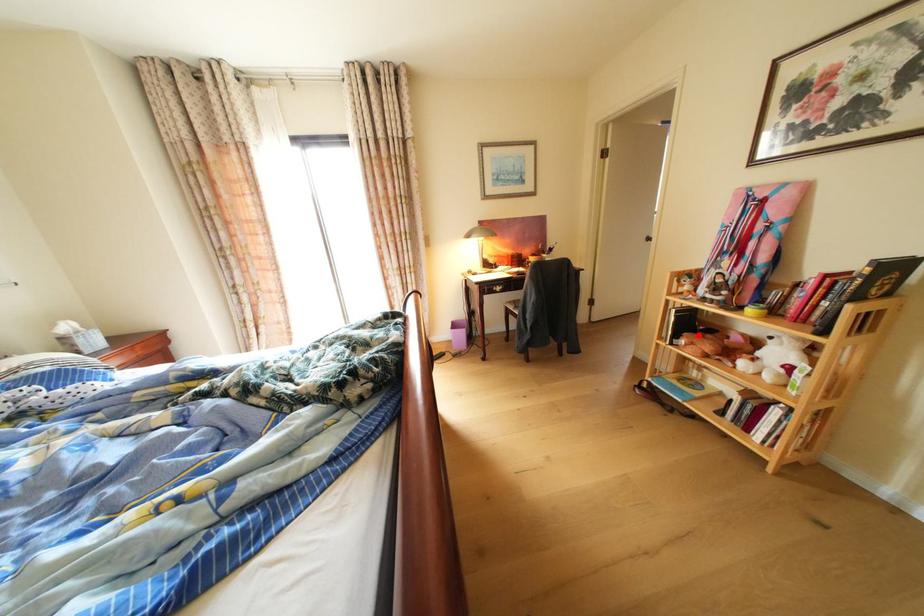
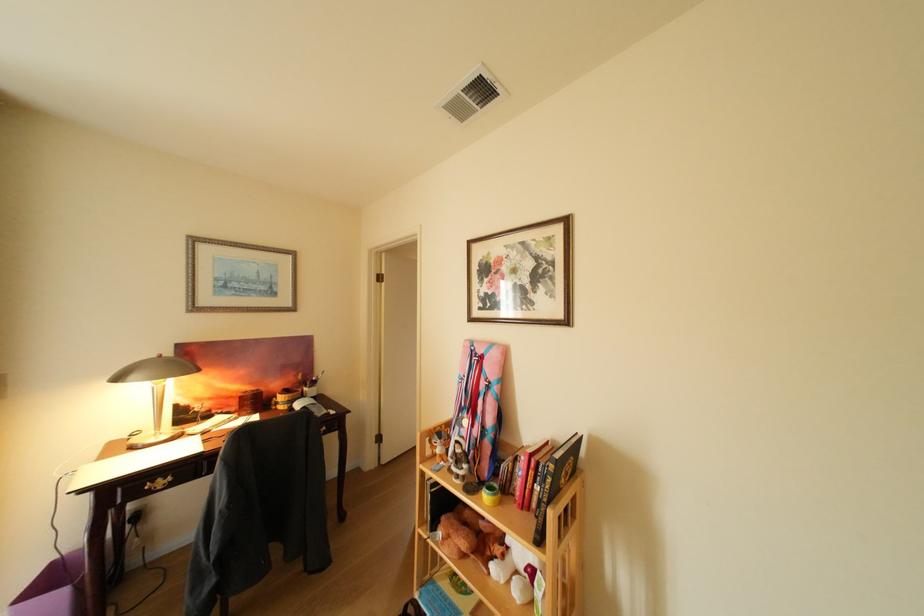
Question: I am providing you with two images of the same scene from different viewpoints. A red point is shown in image1. For the corresponding object point in image2, is it positioned nearer or farther from the camera?

Choices:
 (A) Nearer
 (B) Farther

Answer: (B)